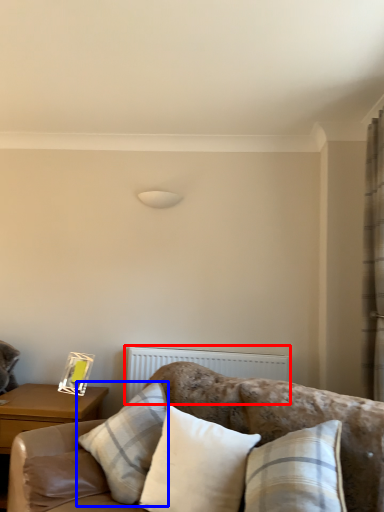
Question: Among these objects, which one is farthest to the camera, radiator (highlighted by a red box) or pillow (highlighted by a blue box)?

Choices:
 (A) radiator
 (B) pillow

Answer: (A)